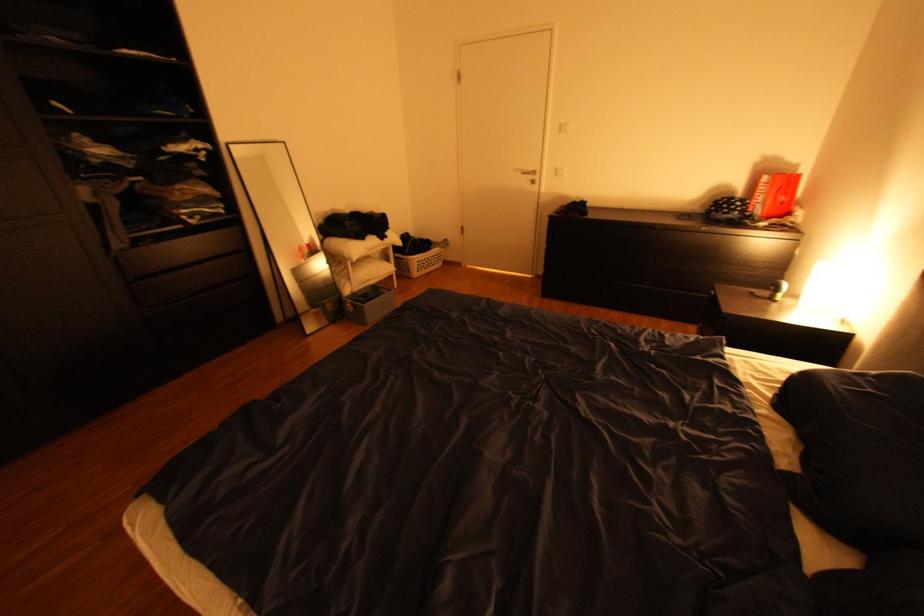
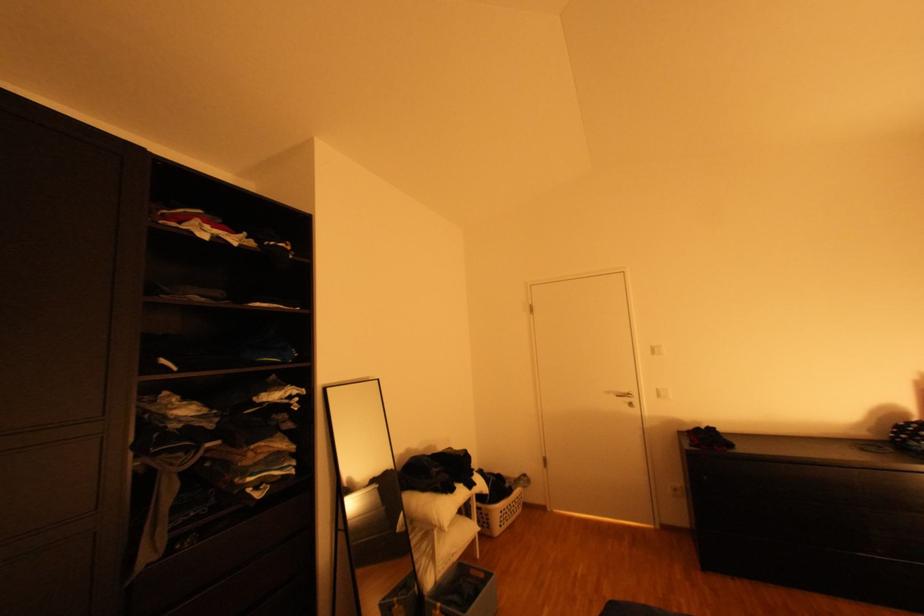
Locate, in the second image, the point that corresponds to [433,264] in the first image.

(516, 513)